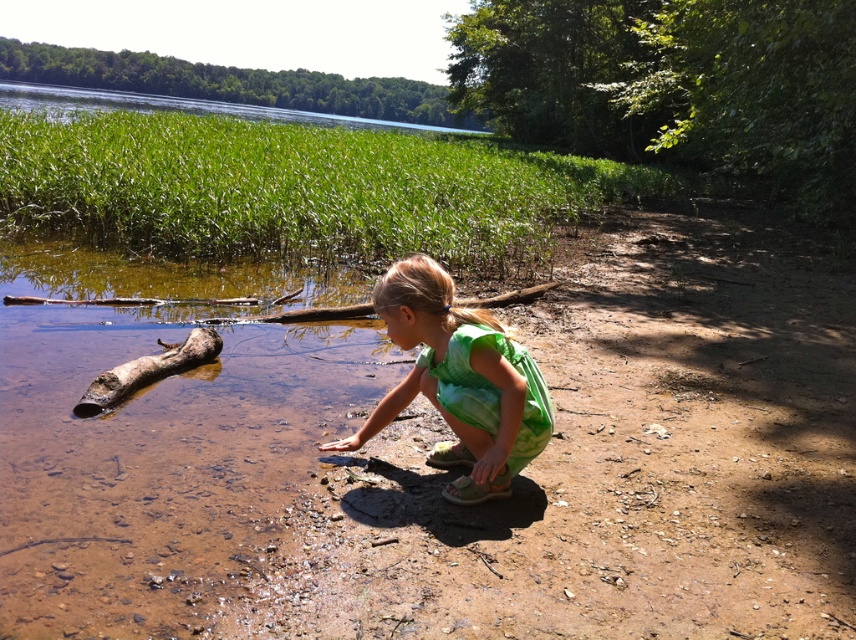
Does green grass at upper center appear under brown rough log at left?

No, green grass at upper center is not below brown rough log at left.

Who is more distant from viewer, (27, 83) or (162, 358)?

The point (27, 83) is more distant.

Between point (177, 104) and point (201, 339), which one is positioned behind?

The point (177, 104) is behind.

Where is `green grass at upper center`? green grass at upper center is located at coordinates (179, 106).

Is brown sandy soil at lower center to the right of green grass at upper center from the viewer's perspective?

Indeed, brown sandy soil at lower center is positioned on the right side of green grass at upper center.

Is point (631, 289) closer to viewer compared to point (51, 96)?

Yes, it is.

Who is more distant from viewer, [729,612] or [217,104]?

Positioned behind is point [217,104].

You are a GUI agent. You are given a task and a screenshot of the screen. Output one action in this format:
    pyautogui.click(x=<x>, y=<y>)
    Task: Click on the brown sandy soil at lower center
    The image size is (856, 640).
    Given the screenshot: What is the action you would take?
    614,465

Is point (498, 444) positioned after point (3, 81)?

No, (498, 444) is in front of (3, 81).

Between green tie-dye dress at center and green grass at upper center, which one appears on the left side from the viewer's perspective?

From the viewer's perspective, green grass at upper center appears more on the left side.

You are a GUI agent. You are given a task and a screenshot of the screen. Output one action in this format:
    pyautogui.click(x=<x>, y=<y>)
    Task: Click on the green tie-dye dress at center
    
    Given the screenshot: What is the action you would take?
    tap(461, 381)

This screenshot has height=640, width=856. I want to click on green tie-dye dress at center, so click(461, 381).